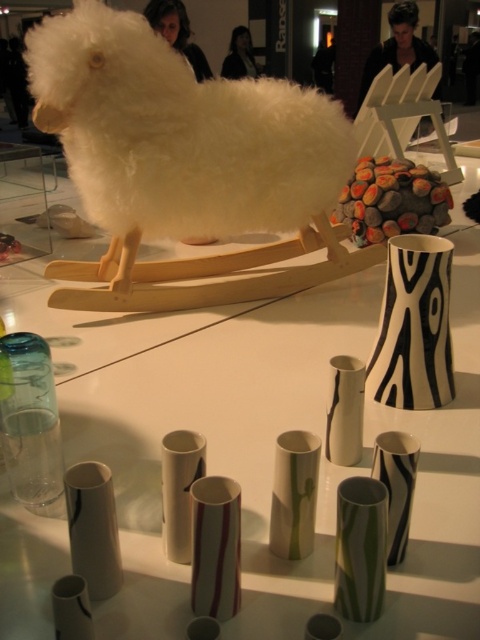
Does white fluffy sheep at center have a larger size compared to black and white striped vase at center right?

Indeed, white fluffy sheep at center has a larger size compared to black and white striped vase at center right.

Can you confirm if white fluffy sheep at center is positioned above black and white striped vase at center right?

Indeed, white fluffy sheep at center is positioned over black and white striped vase at center right.

Is point (207, 152) farther from camera compared to point (393, 371)?

Yes.

The image size is (480, 640). I want to click on white fluffy sheep at center, so click(x=179, y=148).